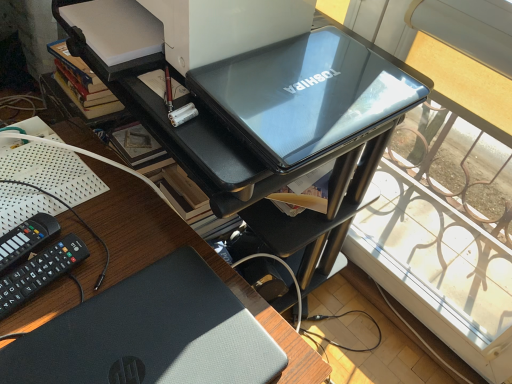
Question: Is black plastic remote control at lower left, which ranks as the second equipment in left-to-right order, bigger than slate gray matte laptop at lower left?

Choices:
 (A) yes
 (B) no

Answer: (B)

Question: Considering the relative positions of black plastic remote control at lower left, which ranks as the first equipment in right-to-left order, and slate gray matte laptop at lower left in the image provided, is black plastic remote control at lower left, which ranks as the first equipment in right-to-left order, in front of slate gray matte laptop at lower left?

Choices:
 (A) yes
 (B) no

Answer: (B)

Question: Considering the relative sizes of black plastic remote control at lower left, which ranks as the first equipment in right-to-left order, and slate gray matte laptop at lower left in the image provided, is black plastic remote control at lower left, which ranks as the first equipment in right-to-left order, shorter than slate gray matte laptop at lower left?

Choices:
 (A) no
 (B) yes

Answer: (A)

Question: From a real-world perspective, is black plastic remote control at lower left, which ranks as the second equipment in left-to-right order, beneath slate gray matte laptop at lower left?

Choices:
 (A) no
 (B) yes

Answer: (B)

Question: Would you say black plastic remote control at lower left, which ranks as the second equipment in left-to-right order, is outside slate gray matte laptop at lower left?

Choices:
 (A) yes
 (B) no

Answer: (A)

Question: From a real-world perspective, is black plastic remote control at lower left, the second equipment positioned from the right, positioned above or below black plastic remote control at lower left, which ranks as the first equipment in right-to-left order?

Choices:
 (A) above
 (B) below

Answer: (B)

Question: From the image's perspective, is black plastic remote control at lower left, the second equipment positioned from the right, above or below black plastic remote control at lower left, which ranks as the second equipment in left-to-right order?

Choices:
 (A) below
 (B) above

Answer: (B)

Question: Visually, is black plastic remote control at lower left, the second equipment positioned from the right, positioned to the left or to the right of black plastic remote control at lower left, which ranks as the first equipment in right-to-left order?

Choices:
 (A) left
 (B) right

Answer: (A)

Question: In terms of height, does black plastic remote control at lower left, the second equipment positioned from the right, look taller or shorter compared to black plastic remote control at lower left, which ranks as the second equipment in left-to-right order?

Choices:
 (A) short
 (B) tall

Answer: (A)

Question: Is point (80, 321) closer or farther from the camera than point (53, 274)?

Choices:
 (A) closer
 (B) farther

Answer: (A)

Question: Looking at the image, does slate gray matte laptop at lower left seem bigger or smaller compared to black plastic remote control at lower left, which ranks as the first equipment in right-to-left order?

Choices:
 (A) small
 (B) big

Answer: (B)

Question: Considering their positions, is slate gray matte laptop at lower left located in front of or behind black plastic remote control at lower left, which ranks as the first equipment in right-to-left order?

Choices:
 (A) behind
 (B) front

Answer: (B)

Question: Is slate gray matte laptop at lower left wider or thinner than black plastic remote control at lower left, which ranks as the second equipment in left-to-right order?

Choices:
 (A) wide
 (B) thin

Answer: (A)

Question: Based on their sizes in the image, would you say glossy black laptop at upper center is bigger or smaller than slate gray matte laptop at lower left?

Choices:
 (A) big
 (B) small

Answer: (A)

Question: Is glossy black laptop at upper center in front of or behind slate gray matte laptop at lower left in the image?

Choices:
 (A) behind
 (B) front

Answer: (A)